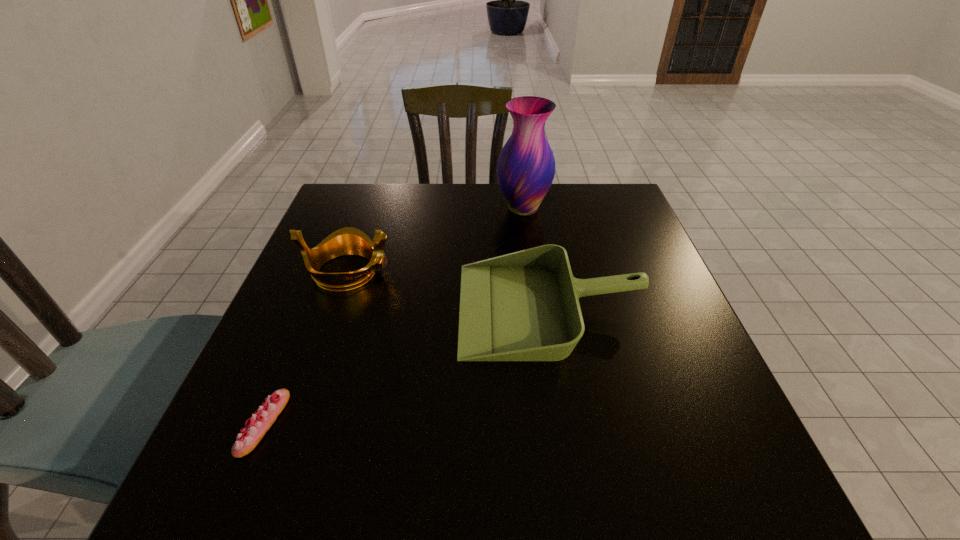
Find the location of a particular element. vacant space in between the shortest object and the farthest object is located at coordinates (394, 316).

Image resolution: width=960 pixels, height=540 pixels. In order to click on free spot between the tallest object and the eclair in this screenshot , I will do `click(394, 316)`.

I want to click on free space between the third shortest object and the third tallest object, so click(448, 289).

Locate which object ranks third in proximity to the second shortest object. Please provide its 2D coordinates. Your answer should be formatted as a tuple, i.e. [(x, y)], where the tuple contains the x and y coordinates of a point satisfying the conditions above.

[(260, 422)]

Identify which object is located as the nearest to the tiara. Please provide its 2D coordinates. Your answer should be formatted as a tuple, i.e. [(x, y)], where the tuple contains the x and y coordinates of a point satisfying the conditions above.

[(523, 306)]

Locate an element on the screen. Image resolution: width=960 pixels, height=540 pixels. free spot that satisfies the following two spatial constraints: 1. on the scoop of the second shortest object; 2. on the front side of the nearest object is located at coordinates (569, 423).

Locate an element on the screen. This screenshot has width=960, height=540. vacant point that satisfies the following two spatial constraints: 1. on the back side of the farthest object; 2. on the right side of the eclair is located at coordinates (351, 208).